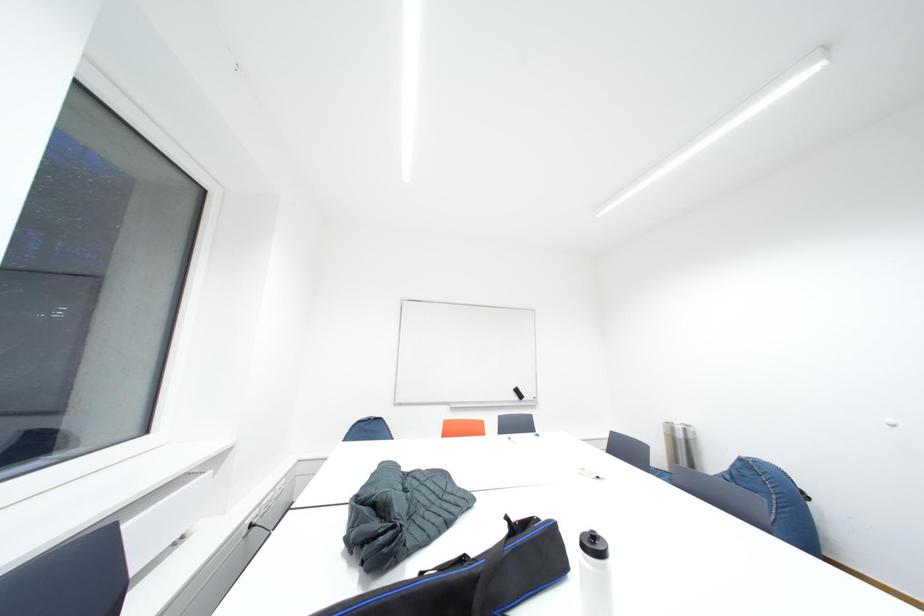
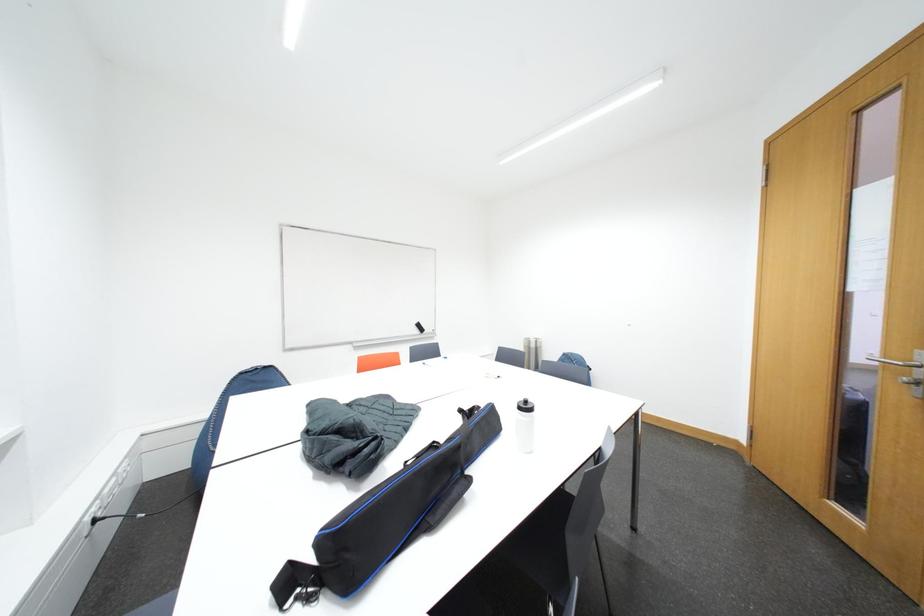
Question: How did the camera likely rotate?

Choices:
 (A) Left
 (B) Right
 (C) Up
 (D) Down

Answer: (B)